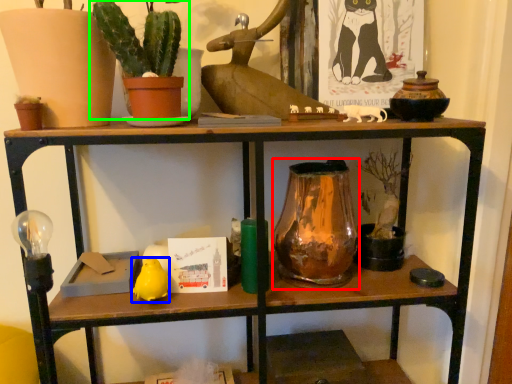
Question: Which object is the closest to the glass vase (highlighted by a red box)? Choose among these: animal (highlighted by a blue box) or houseplant (highlighted by a green box).

Choices:
 (A) animal
 (B) houseplant

Answer: (A)